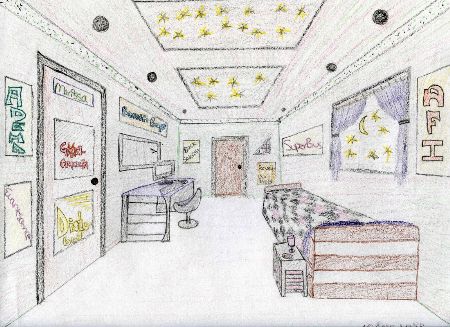
Identify the location of doorknob. The width and height of the screenshot is (450, 327). (94, 180).